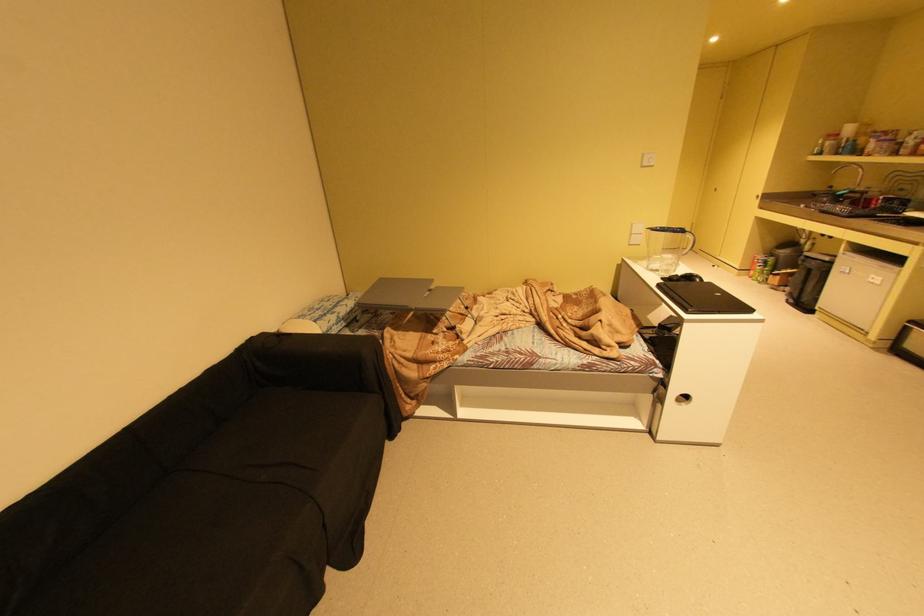
Where would you resting arm the black sofa armrest? Please return your answer as a coordinate pair (x, y).

(319, 362)